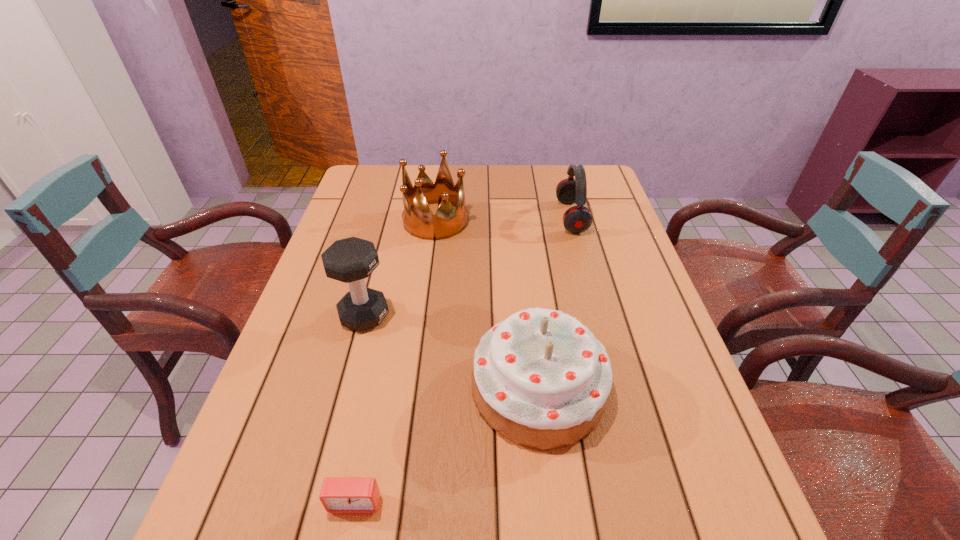
Image resolution: width=960 pixels, height=540 pixels. Identify the location of dumbbell. (350, 260).

Image resolution: width=960 pixels, height=540 pixels. I want to click on crown, so click(x=418, y=220).

The height and width of the screenshot is (540, 960). Identify the location of the fourth farthest object. (541, 379).

In order to click on earphone in this screenshot , I will do `click(577, 219)`.

Find the location of a particular element. The width and height of the screenshot is (960, 540). the shortest object is located at coordinates (338, 494).

This screenshot has width=960, height=540. Identify the location of alarm clock. (338, 494).

Identify the location of vacant region located on the right of the third farthest object. (502, 315).

Identify the location of blank area located 0.280m on the front of the crown. (424, 310).

You are a GUI agent. You are given a task and a screenshot of the screen. Output one action in this format:
    pyautogui.click(x=<x>, y=<y>)
    Task: Click on the vacant space situated 0.340m on the back of the fourth farthest object
    This screenshot has height=540, width=960.
    Given the screenshot: What is the action you would take?
    [521, 246]

Where is `free spot located on the ear cups of the earphone`? free spot located on the ear cups of the earphone is located at coordinates pyautogui.click(x=525, y=217).